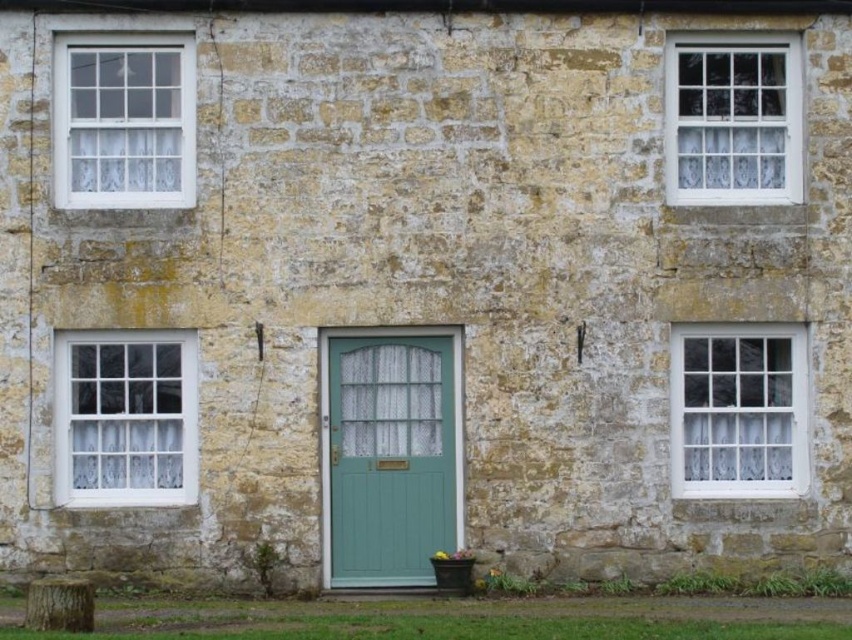
Is point (72, 195) farther from viewer compared to point (691, 488)?

That is False.

Find the location of a particular element. This screenshot has width=852, height=640. white glass window at upper left is located at coordinates (124, 122).

How far apart are white lace curtain at lower left and white glass window at upper left?

white lace curtain at lower left and white glass window at upper left are 1.50 meters apart from each other.

Between white lace curtain at lower left and white glass window at upper left, which one appears on the left side from the viewer's perspective?

white glass window at upper left

Identify the location of white lace curtain at lower left. (125, 417).

Is white lace curtain at lower left to the left of white textured glass window at lower right from the viewer's perspective?

Indeed, white lace curtain at lower left is positioned on the left side of white textured glass window at lower right.

This screenshot has height=640, width=852. What do you see at coordinates (125, 417) in the screenshot?
I see `white lace curtain at lower left` at bounding box center [125, 417].

Describe the element at coordinates (125, 417) in the screenshot. This screenshot has width=852, height=640. I see `white lace curtain at lower left` at that location.

Locate an element on the screen. This screenshot has height=640, width=852. white lace curtain at lower left is located at coordinates (125, 417).